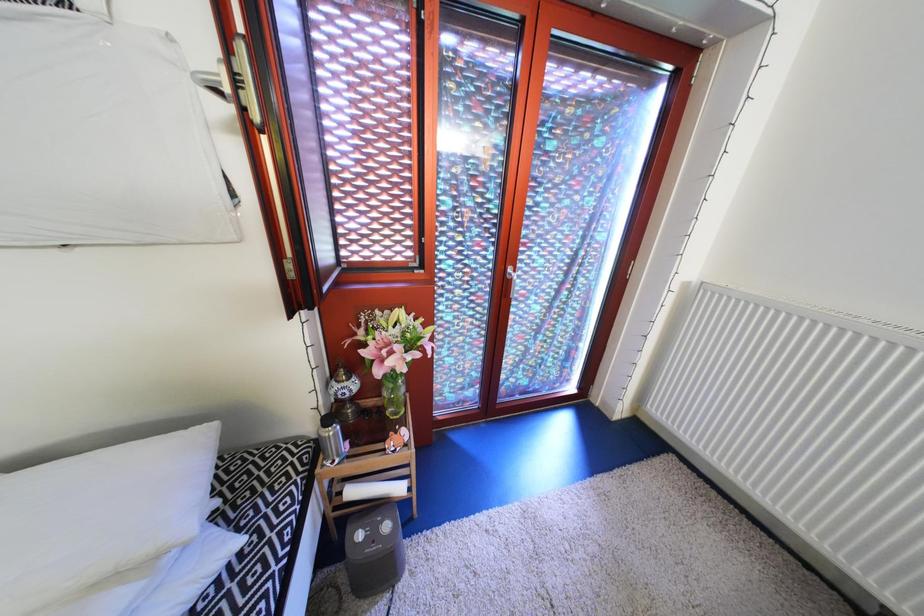
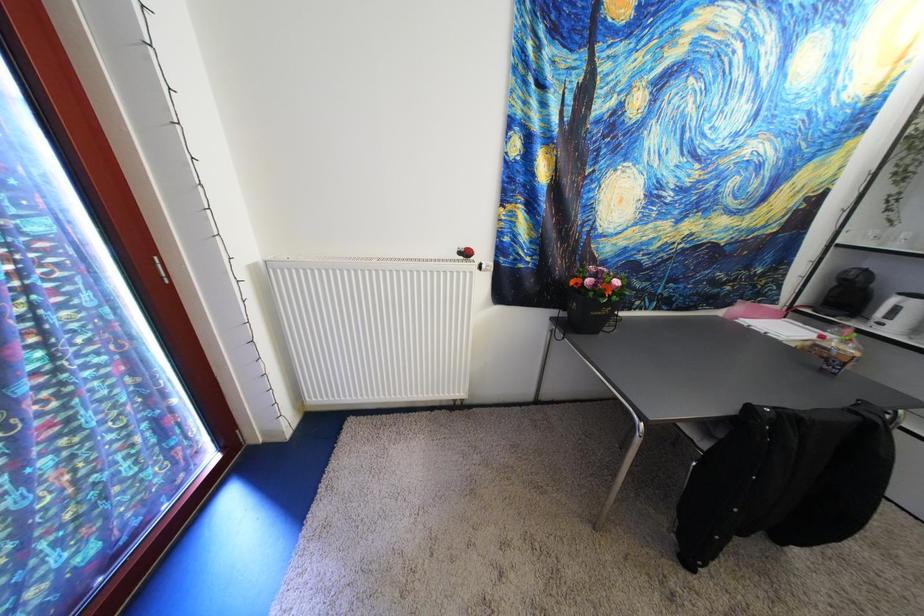
How did the camera likely rotate?

The camera's rotation is toward right-down.